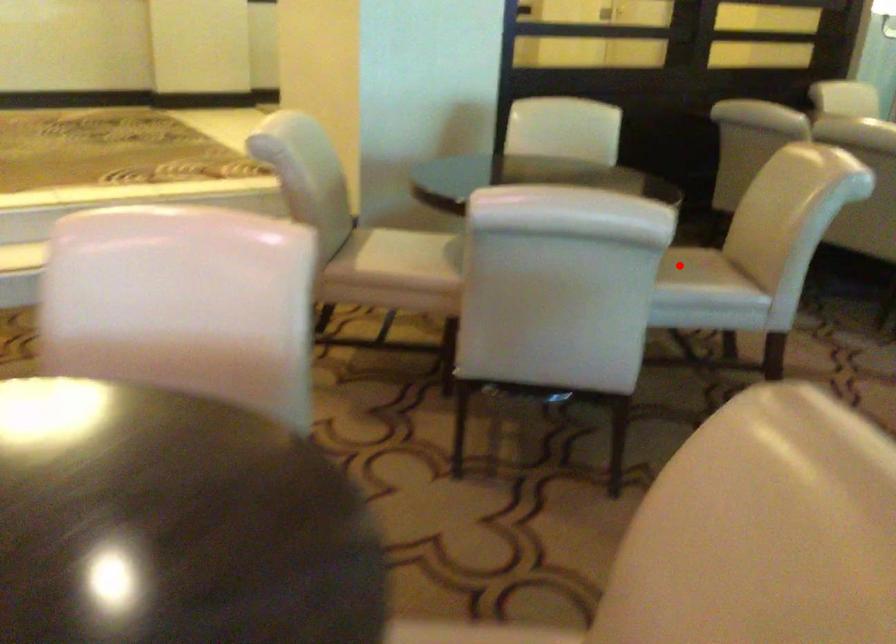
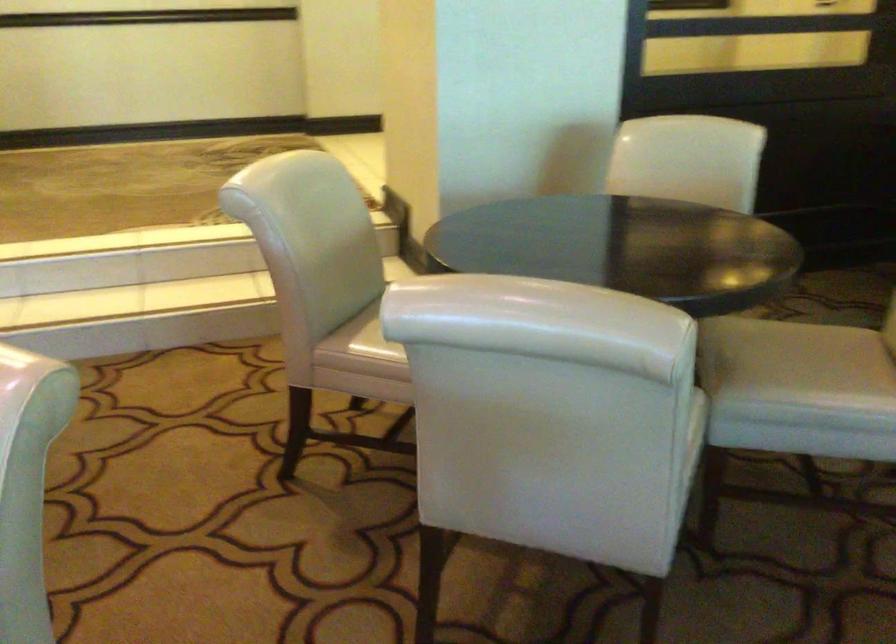
Question: I am providing you with two images of the same scene from different viewpoints. A red point is marked on the first image. Is the red point's position out of view in image 2?

Choices:
 (A) Yes
 (B) No

Answer: (B)